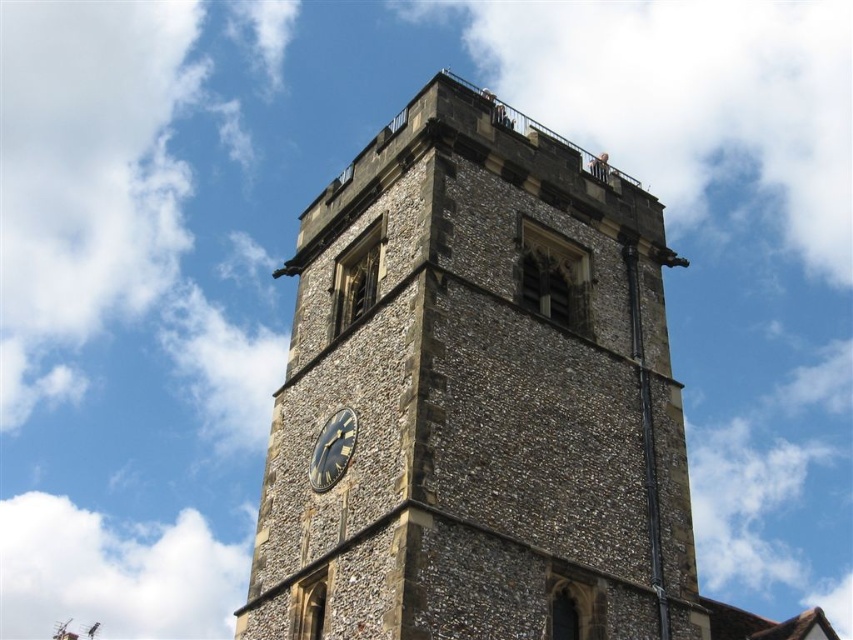
Between brown stone clock tower at upper center and black stone clock at center, which one has less height?

Standing shorter between the two is black stone clock at center.

How far apart are brown stone clock tower at upper center and black stone clock at center?

brown stone clock tower at upper center and black stone clock at center are 2.81 meters apart from each other.

Is point (419, 385) positioned in front of point (347, 410)?

Yes, point (419, 385) is in front of point (347, 410).

Find the location of a particular element. brown stone clock tower at upper center is located at coordinates point(477,397).